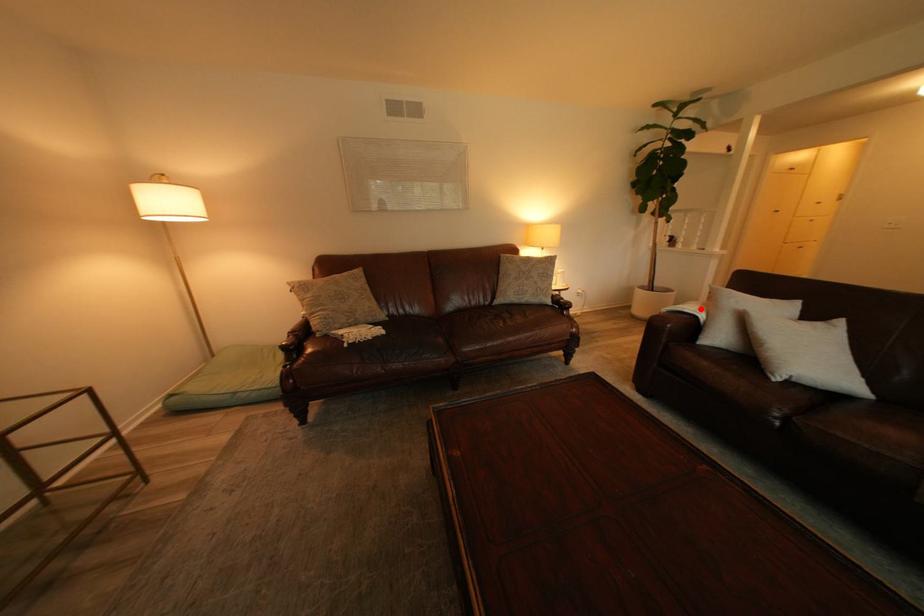
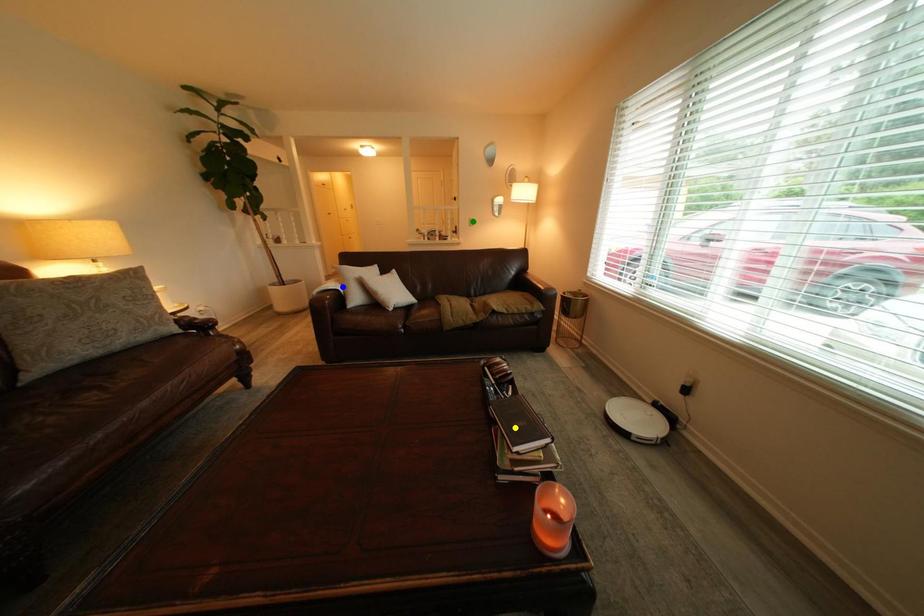
Question: I am providing you with two images of the same scene from different viewpoints. A red point is marked on the first image. You are given multiple points on the second image. Which point in image 2 represents the same 3d spot as the red point in image 1?

Choices:
 (A) yellow point
 (B) green point
 (C) blue point

Answer: (C)